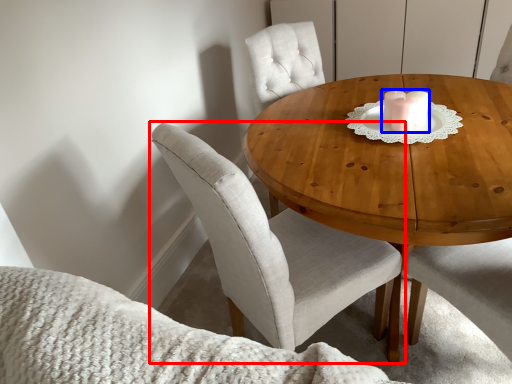
Question: Which of the following is the closest to the observer, chair (highlighted by a red box) or candle holder (highlighted by a blue box)?

Choices:
 (A) chair
 (B) candle holder

Answer: (A)